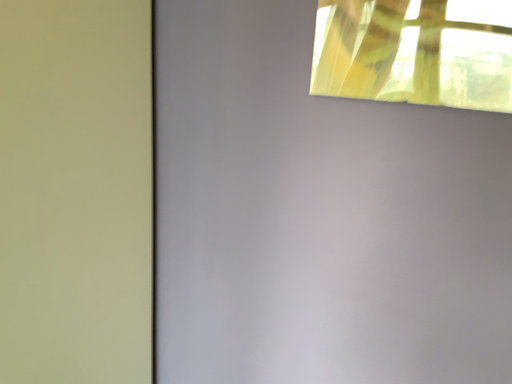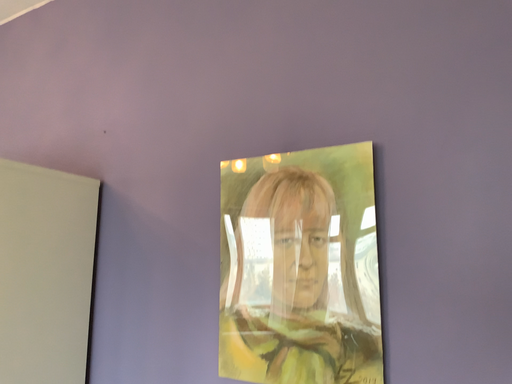
Question: Which way did the camera rotate in the video?

Choices:
 (A) rotated downward
 (B) rotated upward

Answer: (B)